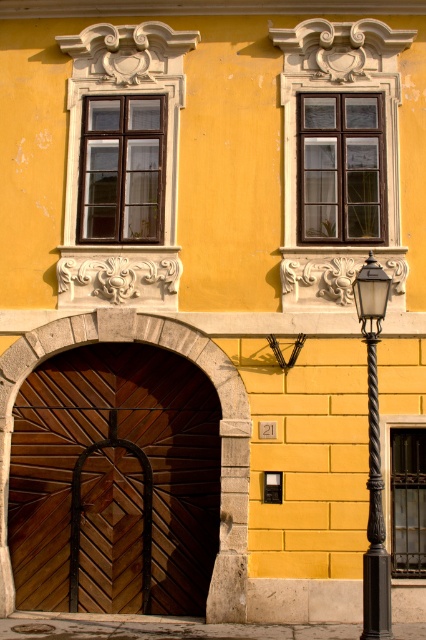
Is point (132, 608) in front of point (374, 262)?

No.

Is wooden at center shorter than matte black lamp post at right?

A: No.

Which is behind, point (154, 516) or point (377, 474)?

Point (154, 516)

Locate an element on the screen. The image size is (426, 640). wooden at center is located at coordinates (115, 483).